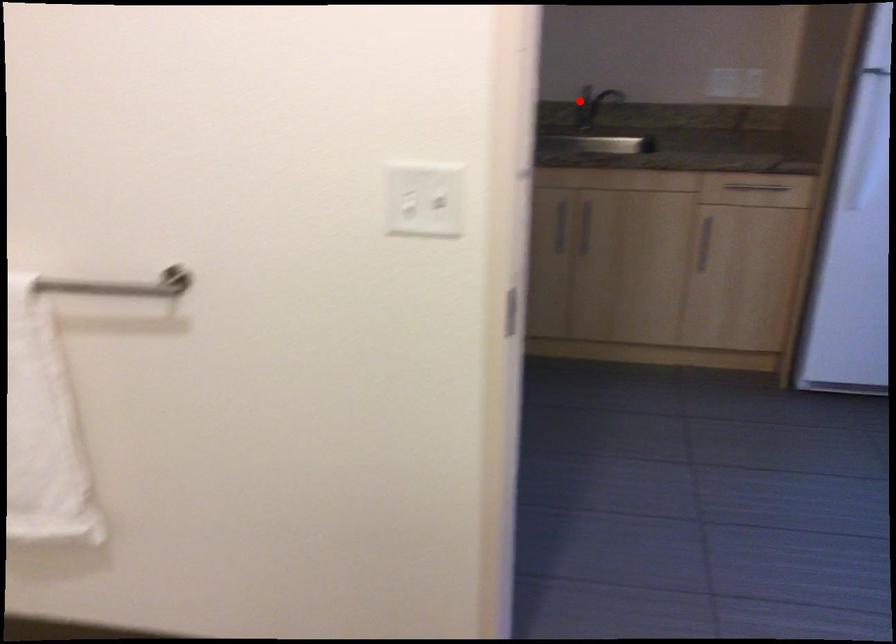
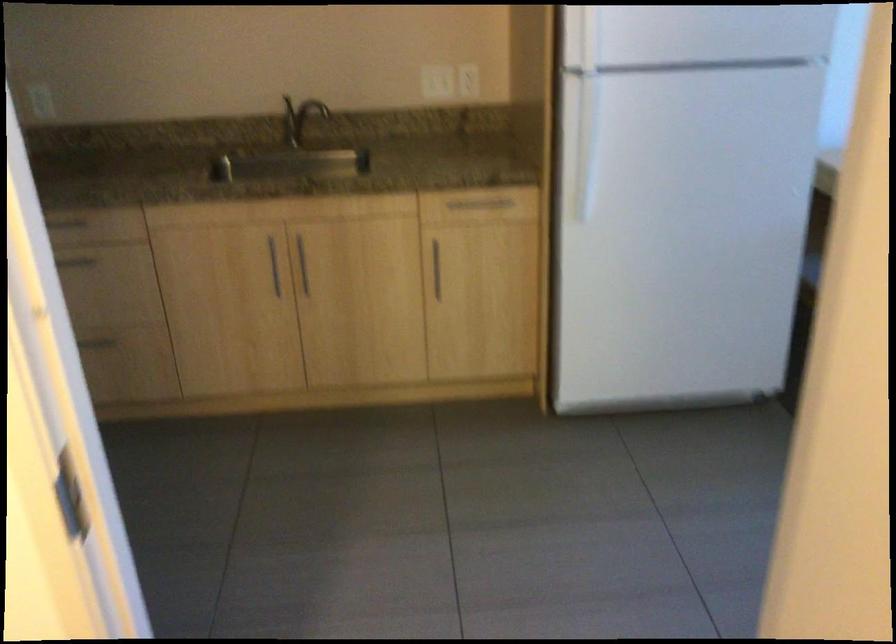
Where in the second image is the point corresponding to the highlighted location from the first image?

(299, 118)